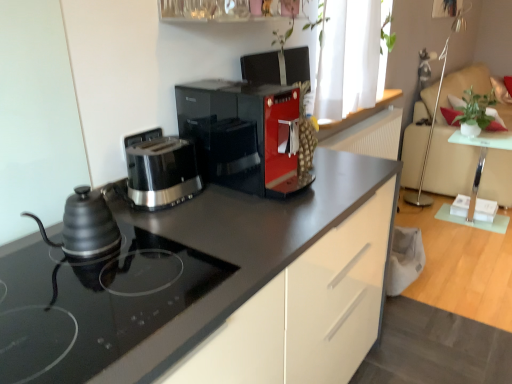
Question: From a real-world perspective, is white fabric window at upper right on top of clear glass shelf at upper center?

Choices:
 (A) yes
 (B) no

Answer: (B)

Question: From a real-world perspective, is white fabric window at upper right under clear glass shelf at upper center?

Choices:
 (A) no
 (B) yes

Answer: (B)

Question: Does white fabric window at upper right have a greater width compared to clear glass shelf at upper center?

Choices:
 (A) no
 (B) yes

Answer: (B)

Question: Does white fabric window at upper right appear on the right side of clear glass shelf at upper center?

Choices:
 (A) yes
 (B) no

Answer: (A)

Question: Considering the relative sizes of white fabric window at upper right and clear glass shelf at upper center in the image provided, is white fabric window at upper right thinner than clear glass shelf at upper center?

Choices:
 (A) no
 (B) yes

Answer: (A)

Question: Is white fabric window at upper right shorter than clear glass shelf at upper center?

Choices:
 (A) no
 (B) yes

Answer: (A)

Question: Considering the relative sizes of clear glass table at right and white fabric window at upper right in the image provided, is clear glass table at right taller than white fabric window at upper right?

Choices:
 (A) yes
 (B) no

Answer: (B)

Question: Does clear glass table at right contain white fabric window at upper right?

Choices:
 (A) yes
 (B) no

Answer: (B)

Question: Is clear glass table at right to the left of white fabric window at upper right from the viewer's perspective?

Choices:
 (A) no
 (B) yes

Answer: (A)

Question: Does clear glass table at right have a larger size compared to white fabric window at upper right?

Choices:
 (A) no
 (B) yes

Answer: (A)

Question: From the image's perspective, is clear glass table at right below white fabric window at upper right?

Choices:
 (A) yes
 (B) no

Answer: (A)

Question: From the image's perspective, does clear glass table at right appear higher than white fabric window at upper right?

Choices:
 (A) yes
 (B) no

Answer: (B)

Question: Does clear glass table at right have a larger size compared to black matte kettle at left?

Choices:
 (A) no
 (B) yes

Answer: (B)